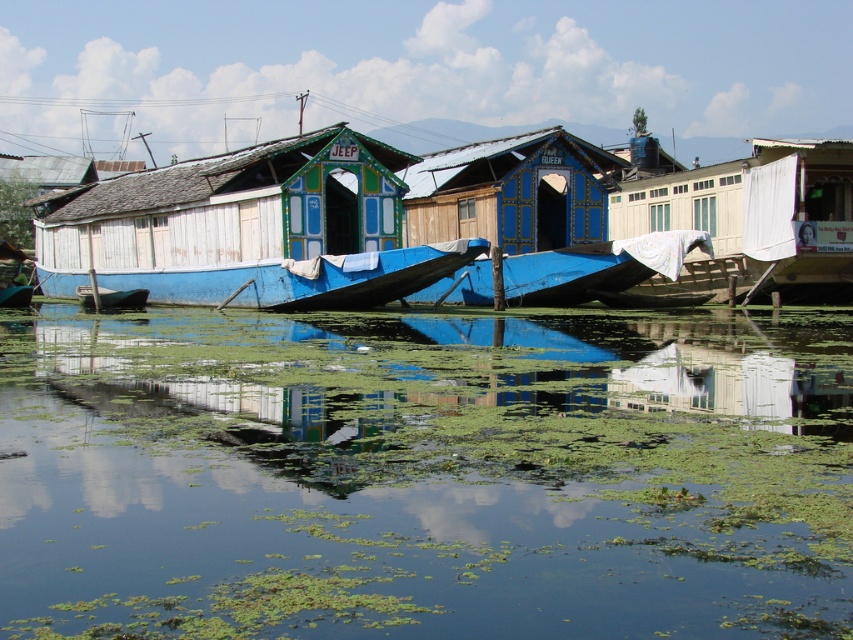
Question: Does blue wooden hut at center appear on the left side of white wooden boat at center?

Choices:
 (A) no
 (B) yes

Answer: (A)

Question: Which point is farther to the camera?

Choices:
 (A) blue matte boat at center
 (B) white wooden boat at center

Answer: (A)

Question: Can you confirm if green algae water at center is bigger than blue matte boat at center?

Choices:
 (A) yes
 (B) no

Answer: (A)

Question: Which point is farther from the camera taking this photo?

Choices:
 (A) (119, 298)
 (B) (637, 248)
 (C) (585, 198)
 (D) (231, 269)

Answer: (A)

Question: Which point is farther to the camera?

Choices:
 (A) (527, 278)
 (B) (257, 320)
 (C) (396, 257)
 (D) (90, 304)

Answer: (D)

Question: Where is blue wooden hut at center located in relation to green plastic boat at center in the image?

Choices:
 (A) below
 (B) above

Answer: (B)